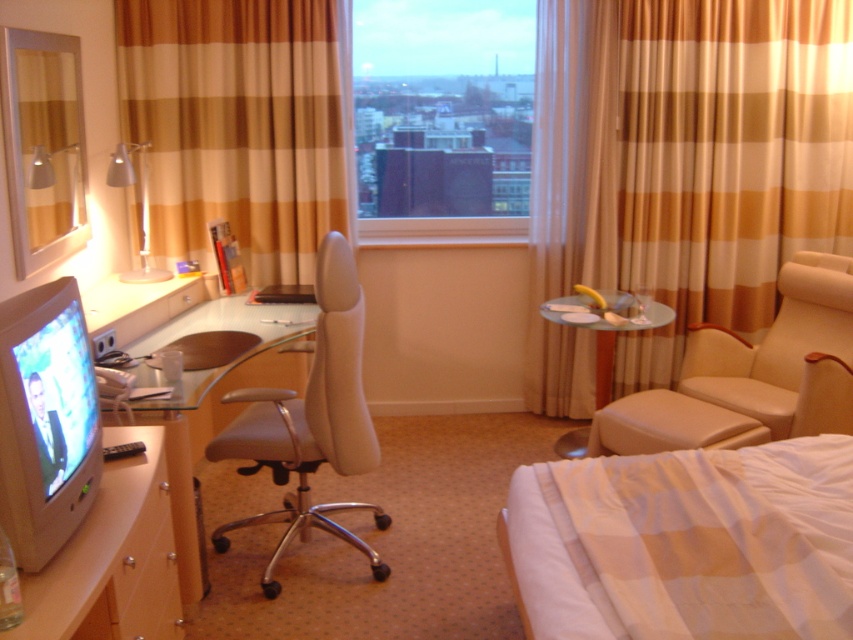
You are standing at the point marked as point (102,584). The distance between you and the desk is 5.26 feet. If you want to walk to the desk, will you have enough space to move freely?

The distance between point (102,584) and the desk is 5.26 feet. Since the desk is part of the hotel room setup, there should be sufficient space for you to move freely towards it.

You are a guest in the hotel room and want to place a small lamp on the clear glass table at center. However, you need to ensure that the white glossy computer desk at lower left won

The white glossy computer desk at lower left is located below the clear glass table at center, so placing the lamp on the clear glass table at center won